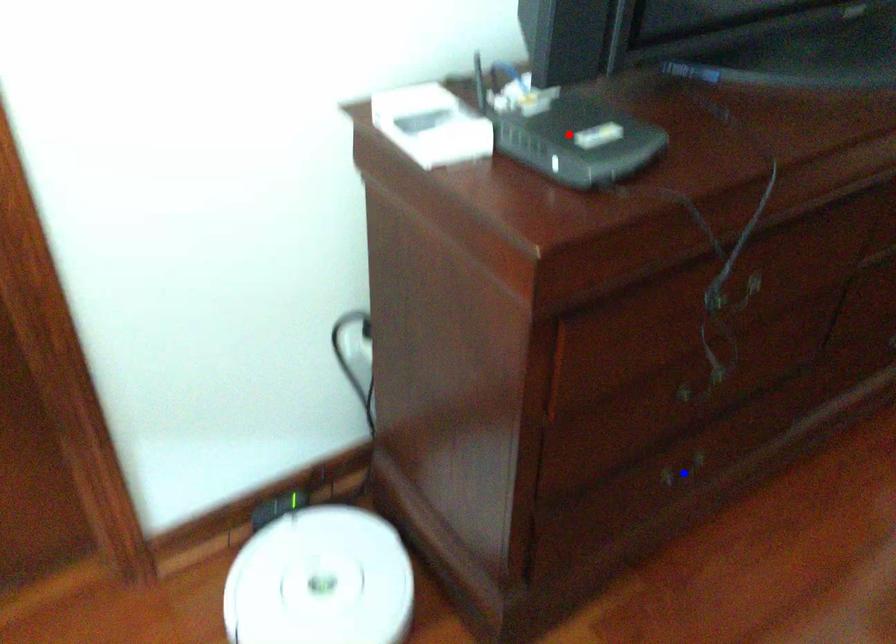
Question: Two points are marked on the image. Which point is closer to the camera?

Choices:
 (A) Blue point is closer.
 (B) Red point is closer.

Answer: (B)